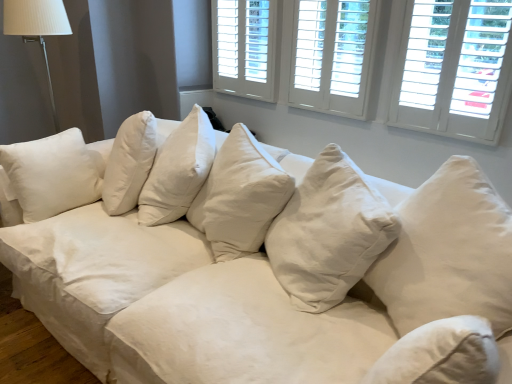
Question: Does point (138, 301) appear closer or farther from the camera than point (256, 71)?

Choices:
 (A) farther
 (B) closer

Answer: (B)

Question: Considering the positions of white cotton couch at center and white wood shutters at upper center, which appears as the third window when viewed from the right, in the image, is white cotton couch at center bigger or smaller than white wood shutters at upper center, which appears as the third window when viewed from the right,?

Choices:
 (A) big
 (B) small

Answer: (A)

Question: Which object is positioned farthest from the white fabric lampshade at upper left?

Choices:
 (A) white wood shutters at upper right, arranged as the 1th window when viewed from the right
 (B) white cotton couch at center
 (C) white wood window at upper center, the second window from the right
 (D) beige cotton pillow at center
 (E) white wood shutters at upper center, which appears as the third window when viewed from the right

Answer: (D)

Question: Which object is the closest to the beige cotton pillow at center?

Choices:
 (A) white cotton couch at center
 (B) white wood window at upper center, the 2th window positioned from the left
 (C) white wood shutters at upper center, which appears as the third window when viewed from the right
 (D) white fabric lampshade at upper left
 (E) white wood shutters at upper right, arranged as the 1th window when viewed from the right

Answer: (A)